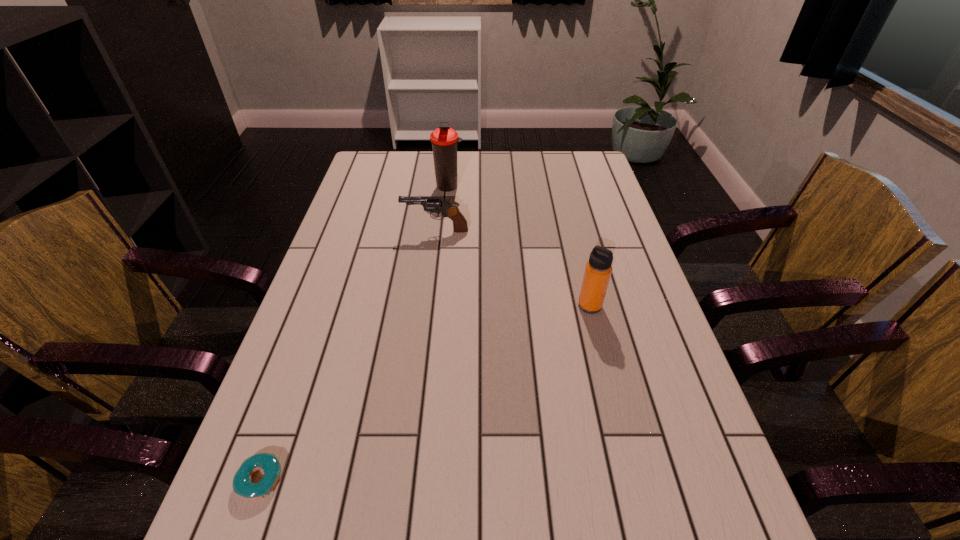
The width and height of the screenshot is (960, 540). I want to click on free point located 0.210m along the barrel of the gun, so click(333, 231).

At what (x,y) coordinates should I click in order to perform the action: click on vacant space located 0.180m along the barrel of the gun. Please return your answer as a coordinate pair (x, y). Looking at the image, I should click on (343, 231).

Where is `vacant space located along the barrel of the gun`? The width and height of the screenshot is (960, 540). vacant space located along the barrel of the gun is located at coordinates (367, 231).

The height and width of the screenshot is (540, 960). I want to click on free region located 0.100m on the back of the leftmost object, so click(x=285, y=410).

Identify the location of object present at the far edge. (444, 140).

Locate an element on the screen. This screenshot has height=540, width=960. object that is at the left edge is located at coordinates [269, 463].

The image size is (960, 540). Identify the location of object present at the right edge. tap(598, 269).

You are a GUI agent. You are given a task and a screenshot of the screen. Output one action in this format:
    pyautogui.click(x=<x>, y=<y>)
    Task: Click on the vacant space at the far edge of the desktop
    
    Given the screenshot: What is the action you would take?
    pyautogui.click(x=418, y=179)

Where is `free spot at the left edge of the desktop`? This screenshot has width=960, height=540. free spot at the left edge of the desktop is located at coordinates (371, 206).

The image size is (960, 540). Identify the location of vacant space at the right edge. (732, 539).